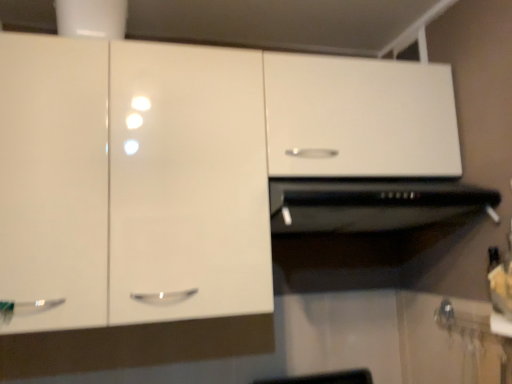
The width and height of the screenshot is (512, 384). What do you see at coordinates (371, 204) in the screenshot?
I see `black matte vent at center` at bounding box center [371, 204].

Where is `black matte vent at center`? The width and height of the screenshot is (512, 384). black matte vent at center is located at coordinates (371, 204).

Image resolution: width=512 pixels, height=384 pixels. Identify the location of white glossy cabinet at upper center. (185, 167).

What do you see at coordinates (185, 167) in the screenshot?
I see `white glossy cabinet at upper center` at bounding box center [185, 167].

Identify the location of black matte vent at center. This screenshot has width=512, height=384. (371, 204).

Considering the relative positions of black matte vent at center and white glossy cabinet at upper center in the image provided, is black matte vent at center to the left or to the right of white glossy cabinet at upper center?

Based on their positions, black matte vent at center is located to the right of white glossy cabinet at upper center.

Is black matte vent at center in front of or behind white glossy cabinet at upper center in the image?

Clearly, black matte vent at center is behind white glossy cabinet at upper center.

Considering the positions of point (300, 193) and point (170, 315), is point (300, 193) closer or farther from the camera than point (170, 315)?

Point (300, 193) is farther from the camera than point (170, 315).

Based on the photo, from the image's perspective, is black matte vent at center positioned above or below white glossy cabinet at upper center?

Based on their image positions, black matte vent at center is located beneath white glossy cabinet at upper center.

From a real-world perspective, does black matte vent at center stand above white glossy cabinet at upper center?

No, from a real-world perspective, black matte vent at center is not above white glossy cabinet at upper center.

Consider the image. Is black matte vent at center wider than white glossy cabinet at upper center?

Indeed, black matte vent at center has a greater width compared to white glossy cabinet at upper center.

Which of these two, black matte vent at center or white glossy cabinet at upper center, stands taller?

With more height is white glossy cabinet at upper center.

Considering the sizes of black matte vent at center and white glossy cabinet at upper center in the image, is black matte vent at center bigger or smaller than white glossy cabinet at upper center?

black matte vent at center is smaller than white glossy cabinet at upper center.

In the scene shown: Would you say black matte vent at center is outside white glossy cabinet at upper center?

No, black matte vent at center is not outside of white glossy cabinet at upper center.

Is black matte vent at center touching white glossy cabinet at upper center?

black matte vent at center is not next to white glossy cabinet at upper center, and they're not touching.

Is black matte vent at center facing towards white glossy cabinet at upper center?

Yes, black matte vent at center faces towards white glossy cabinet at upper center.

How many degrees apart are the facing directions of black matte vent at center and white glossy cabinet at upper center?

The facing directions of black matte vent at center and white glossy cabinet at upper center are 0.249 degrees apart.

Where is `vent lying below the white glossy cabinet at upper center (from the image's perspective)`? This screenshot has width=512, height=384. vent lying below the white glossy cabinet at upper center (from the image's perspective) is located at coordinates click(x=371, y=204).

Is white glossy cabinet at upper center to the left or to the right of black matte vent at center in the image?

white glossy cabinet at upper center is positioned on black matte vent at center's left side.

Does white glossy cabinet at upper center lie in front of black matte vent at center?

Yes, it is in front of black matte vent at center.

Between point (205, 149) and point (384, 224), which one is positioned in front?

The point (205, 149) is closer to the camera.

From the image's perspective, is white glossy cabinet at upper center located above or below black matte vent at center?

white glossy cabinet at upper center is situated higher than black matte vent at center in the image.

From a real-world perspective, relative to black matte vent at center, is white glossy cabinet at upper center vertically above or below?

white glossy cabinet at upper center is situated higher than black matte vent at center in the real world.

Considering the sizes of objects white glossy cabinet at upper center and black matte vent at center in the image provided, who is wider, white glossy cabinet at upper center or black matte vent at center?

With larger width is black matte vent at center.

Which of these two, white glossy cabinet at upper center or black matte vent at center, stands shorter?

With less height is black matte vent at center.

Who is smaller, white glossy cabinet at upper center or black matte vent at center?

black matte vent at center is smaller.

Is white glossy cabinet at upper center outside of black matte vent at center?

white glossy cabinet at upper center is positioned outside black matte vent at center.

Are white glossy cabinet at upper center and black matte vent at center far apart?

No, white glossy cabinet at upper center is not far from black matte vent at center.

Based on the photo, does white glossy cabinet at upper center turn towards black matte vent at center?

Yes.

Measure the distance between white glossy cabinet at upper center and black matte vent at center.

The distance of white glossy cabinet at upper center from black matte vent at center is 8.84 inches.

I want to click on vent on the right of white glossy cabinet at upper center, so [x=371, y=204].

Identify the location of cabinetry above the black matte vent at center (from a real-world perspective). (185, 167).

Locate an element on the screen. vent behind the white glossy cabinet at upper center is located at coordinates (371, 204).